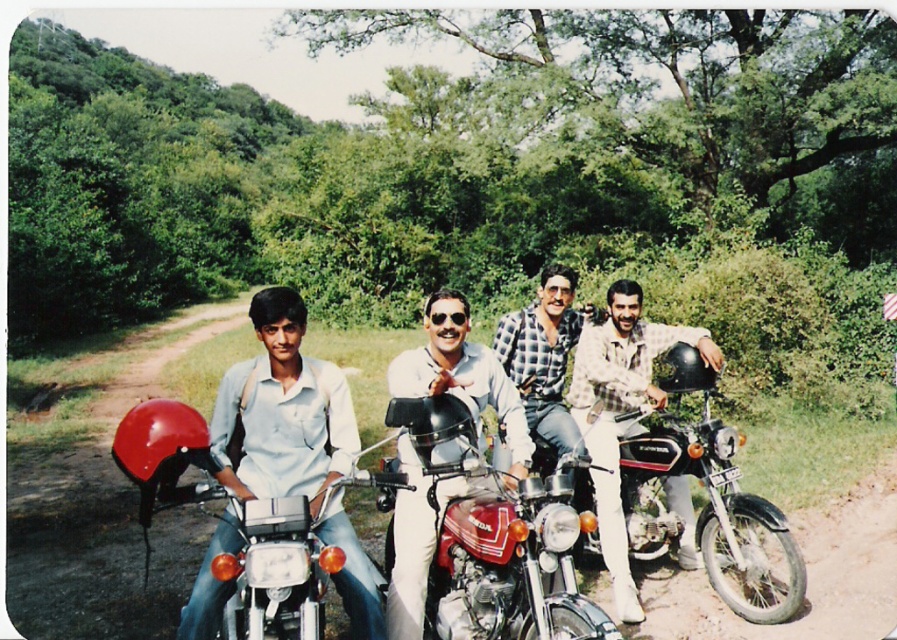
You are a photographer trying to capture a photo of the shiny red motorcycle at center and the plaid shirt at center. Based on their positions, which one should you focus on first if you want to ensure both are in the same frame without moving the camera?

The shiny red motorcycle at center is below the plaid shirt at center, so you should focus on the plaid shirt at center first to ensure both are in the frame without moving the camera. By starting with the higher positioned object, you can adjust the framing to include the lower one as well.